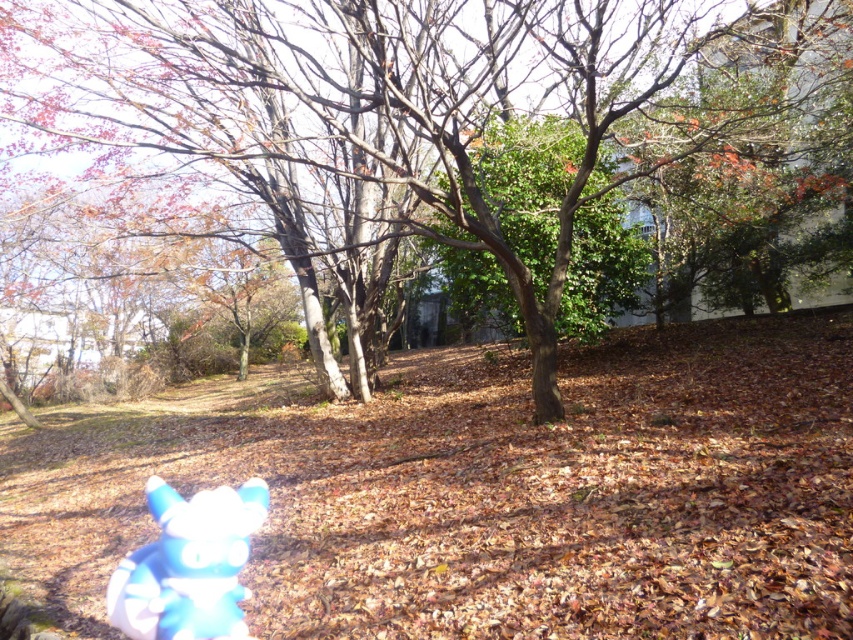
You are a photographer setting up a shot of the brown matte tree at center and the blue plush toy at lower left. You want to ensure both are in focus. Since depth of field decreases with distance, which object should you prioritize focusing on first?

The brown matte tree at center should be prioritized for focus first because it is further away than the blue plush toy at lower left, and depth of field is better managed when focusing on distant objects to keep both in focus.